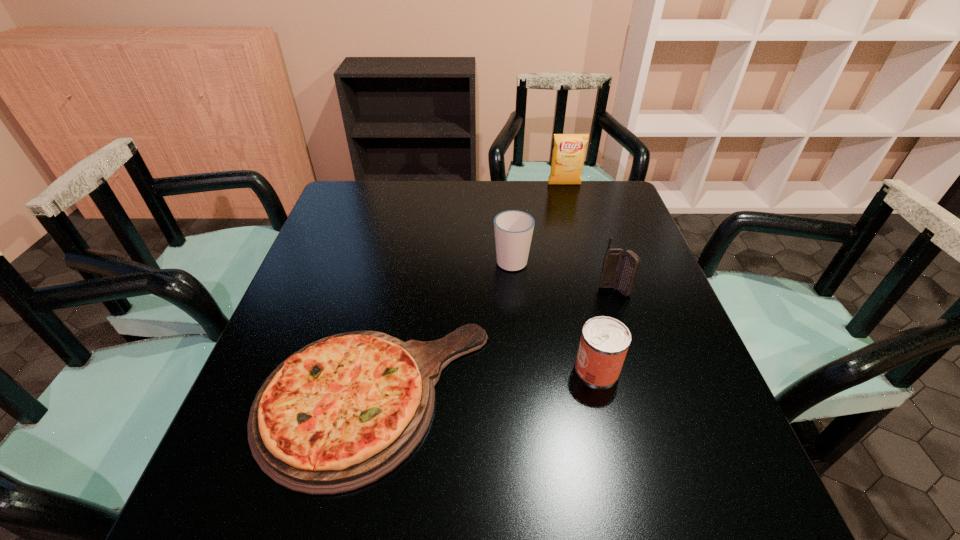
The height and width of the screenshot is (540, 960). I want to click on object that is at the far right corner, so click(568, 154).

The image size is (960, 540). Identify the location of free space at the far edge of the desktop. (552, 195).

At what (x,y) coordinates should I click in order to perform the action: click on blank space at the near edge. Please return your answer as a coordinate pair (x, y). The height and width of the screenshot is (540, 960). Looking at the image, I should click on point(639,514).

In the image, there is a desktop. Where is `vacant space at the left edge`? This screenshot has width=960, height=540. vacant space at the left edge is located at coordinates (347, 244).

In the image, there is a desktop. What are the coordinates of `vacant area at the right edge` in the screenshot? It's located at (675, 461).

Where is `vacant space at the far right corner`? vacant space at the far right corner is located at coordinates (575, 185).

Identify the location of vacant space at the near right corner of the desktop. (758, 494).

Where is `empty location between the farthest object and the fourth object from right to left`? Image resolution: width=960 pixels, height=540 pixels. empty location between the farthest object and the fourth object from right to left is located at coordinates (538, 222).

Where is `free space between the crisp (potato chip) and the cup`? free space between the crisp (potato chip) and the cup is located at coordinates (538, 222).

At what (x,y) coordinates should I click in order to perform the action: click on free spot between the second object from left to right and the farthest object. Please return your answer as a coordinate pair (x, y). The height and width of the screenshot is (540, 960). Looking at the image, I should click on (538, 222).